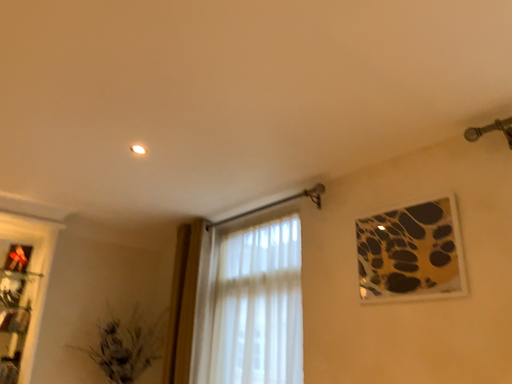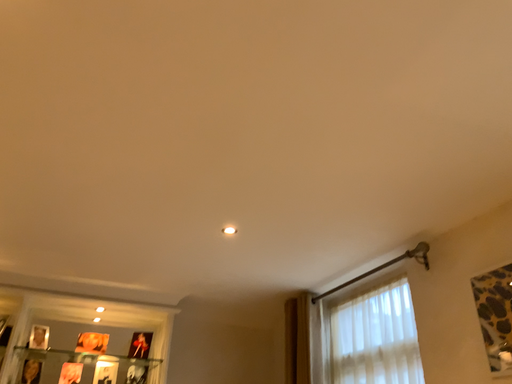
Question: Which way did the camera rotate in the video?

Choices:
 (A) rotated downward
 (B) rotated upward

Answer: (B)